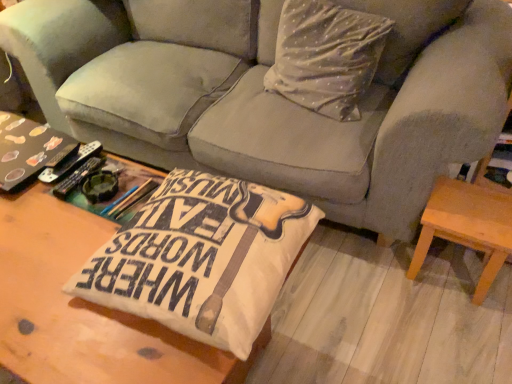
Question: Can you confirm if matte black book at left is shorter than wooden coffee table at center, the second table positioned from the back?

Choices:
 (A) yes
 (B) no

Answer: (A)

Question: Is matte black book at left positioned before wooden coffee table at center, the second table positioned from the back?

Choices:
 (A) yes
 (B) no

Answer: (B)

Question: Is matte black book at left further to camera compared to wooden coffee table at center, the second table positioned from the back?

Choices:
 (A) no
 (B) yes

Answer: (B)

Question: Does matte black book at left have a larger size compared to wooden coffee table at center, marked as the 1th table in a front-to-back arrangement?

Choices:
 (A) no
 (B) yes

Answer: (A)

Question: Would you say matte black book at left is outside wooden coffee table at center, marked as the 1th table in a front-to-back arrangement?

Choices:
 (A) yes
 (B) no

Answer: (A)

Question: Considering the relative sizes of matte black book at left and wooden coffee table at center, the 1th table from the left, in the image provided, is matte black book at left wider than wooden coffee table at center, the 1th table from the left,?

Choices:
 (A) yes
 (B) no

Answer: (B)

Question: Is light brown wooden stool at lower right, which ranks as the 2th table in front-to-back order, bigger than matte black book at left?

Choices:
 (A) yes
 (B) no

Answer: (A)

Question: Considering the relative sizes of light brown wooden stool at lower right, which appears as the first table when viewed from the back, and matte black book at left in the image provided, is light brown wooden stool at lower right, which appears as the first table when viewed from the back, smaller than matte black book at left?

Choices:
 (A) no
 (B) yes

Answer: (A)

Question: Is light brown wooden stool at lower right, arranged as the 1th table when viewed from the right, outside of matte black book at left?

Choices:
 (A) no
 (B) yes

Answer: (B)

Question: Does light brown wooden stool at lower right, which ranks as the 2th table in front-to-back order, appear on the right side of matte black book at left?

Choices:
 (A) no
 (B) yes

Answer: (B)

Question: Is light brown wooden stool at lower right, placed as the 2th table when sorted from left to right, oriented away from matte black book at left?

Choices:
 (A) no
 (B) yes

Answer: (A)

Question: Is light brown wooden stool at lower right, which ranks as the 2th table in front-to-back order, next to matte black book at left and touching it?

Choices:
 (A) yes
 (B) no

Answer: (B)

Question: Can you confirm if velvet gray couch at center is thinner than wooden coffee table at center, which is counted as the second table, starting from the right?

Choices:
 (A) no
 (B) yes

Answer: (A)